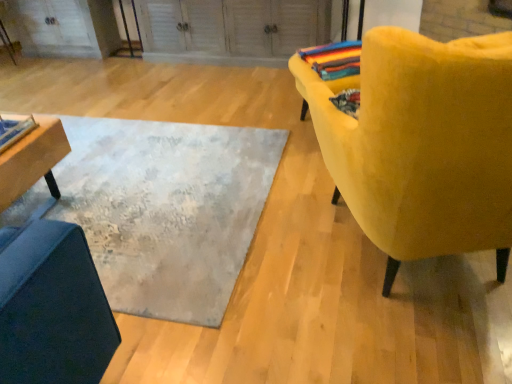
Question: Can we say textured gray rug at center lies outside velvet yellow chair at right?

Choices:
 (A) no
 (B) yes

Answer: (B)

Question: Can you confirm if textured gray rug at center is taller than velvet yellow chair at right?

Choices:
 (A) yes
 (B) no

Answer: (B)

Question: Does textured gray rug at center have a greater width compared to velvet yellow chair at right?

Choices:
 (A) no
 (B) yes

Answer: (B)

Question: Is textured gray rug at center positioned before velvet yellow chair at right?

Choices:
 (A) no
 (B) yes

Answer: (A)

Question: Is textured gray rug at center thinner than velvet yellow chair at right?

Choices:
 (A) no
 (B) yes

Answer: (A)

Question: Is velvet yellow chair at right at the back of textured gray rug at center?

Choices:
 (A) no
 (B) yes

Answer: (A)

Question: Can you confirm if wooden table at left is smaller than textured gray rug at center?

Choices:
 (A) yes
 (B) no

Answer: (A)

Question: From a real-world perspective, is wooden table at left beneath textured gray rug at center?

Choices:
 (A) no
 (B) yes

Answer: (A)

Question: Considering the relative sizes of wooden table at left and textured gray rug at center in the image provided, is wooden table at left thinner than textured gray rug at center?

Choices:
 (A) yes
 (B) no

Answer: (A)

Question: From the image's perspective, would you say wooden table at left is shown under textured gray rug at center?

Choices:
 (A) no
 (B) yes

Answer: (B)

Question: Is wooden table at left wider than textured gray rug at center?

Choices:
 (A) no
 (B) yes

Answer: (A)

Question: Is wooden table at left bigger than textured gray rug at center?

Choices:
 (A) no
 (B) yes

Answer: (A)

Question: Can you confirm if multicolored woven blanket at upper right is taller than wooden table at left?

Choices:
 (A) no
 (B) yes

Answer: (A)